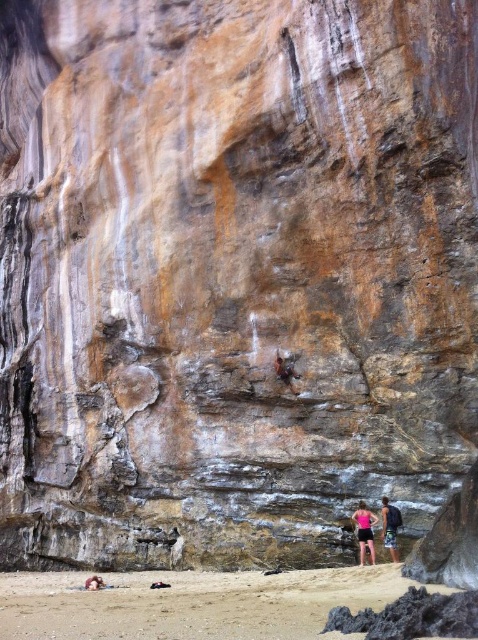
Question: In this image, where is smooth skin person at lower center located relative to rusty metal rock climber at center?

Choices:
 (A) below
 (B) above

Answer: (A)

Question: Based on their relative distances, which object is nearer to the pink matte shorts at lower center?

Choices:
 (A) sandy beach at lower center
 (B) smooth skin person at lower center
 (C) rusty metal rock climber at center

Answer: (B)

Question: Is smooth skin person at lower center above rusty metal rock climber at center?

Choices:
 (A) no
 (B) yes

Answer: (A)

Question: Does sandy beach at lower center appear on the right side of pink matte shorts at lower center?

Choices:
 (A) no
 (B) yes

Answer: (A)

Question: Which of these objects is positioned closest to the pink matte shorts at lower center?

Choices:
 (A) smooth skin person at lower center
 (B) sandy beach at lower center
 (C) rusty metal rock climber at center

Answer: (A)

Question: Which object appears farthest from the camera in this image?

Choices:
 (A) rusty metal rock climber at center
 (B) smooth skin person at lower center

Answer: (A)